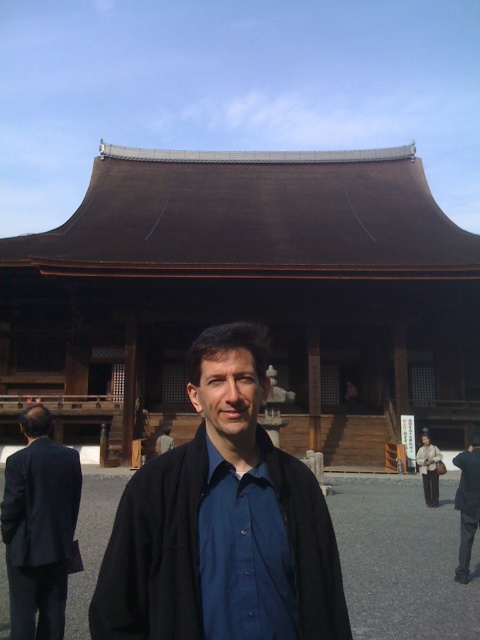
Is point (135, 420) farther from viewer compared to point (26, 424)?

That is True.

Is brown wooden temple at center taller than dark blue suit at left?

Yes.

What are the coordinates of `brown wooden temple at center` in the screenshot? It's located at (253, 292).

Does brown wooden temple at center have a lesser width compared to dark blue shirt at center?

No.

Is point (308, 352) positioned after point (163, 433)?

Yes, it is behind point (163, 433).

What are the coordinates of `brown wooden temple at center` in the screenshot? It's located at (253, 292).

Describe the element at coordinates (243, 556) in the screenshot. This screenshot has width=480, height=640. I see `blue smooth shirt at center` at that location.

Does blue smooth shirt at center have a greater height compared to dark blue suit at left?

Indeed, blue smooth shirt at center has a greater height compared to dark blue suit at left.

The height and width of the screenshot is (640, 480). What do you see at coordinates (243, 556) in the screenshot?
I see `blue smooth shirt at center` at bounding box center [243, 556].

Where is `blue smooth shirt at center`? The width and height of the screenshot is (480, 640). blue smooth shirt at center is located at coordinates (243, 556).